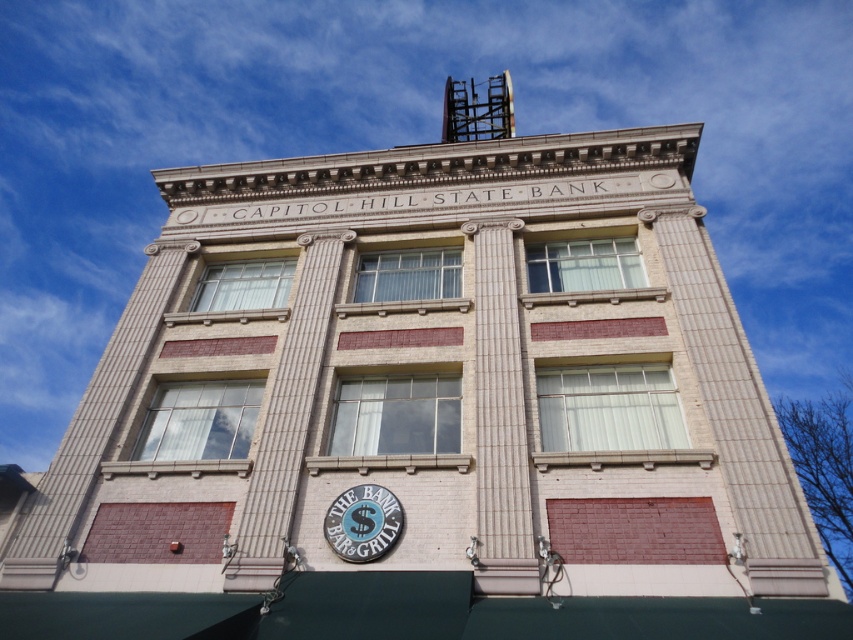
You are standing in front of the building and want to take a photo of the blue metallic sign at lower center. To ensure the white marble pillar at center does not block the view, where should you position yourself relative to the sign?

The white marble pillar at center is positioned on the left side of the blue metallic sign at lower center. To avoid blocking the view, you should move to the right side of the sign.

You are standing in front of the building and want to touch both the smooth stone column at center and the blue metallic sign at lower center. Which object should you reach for first to touch the one closer to you?

You should reach for the smooth stone column at center first because it is closer to the viewer than the blue metallic sign at lower center.